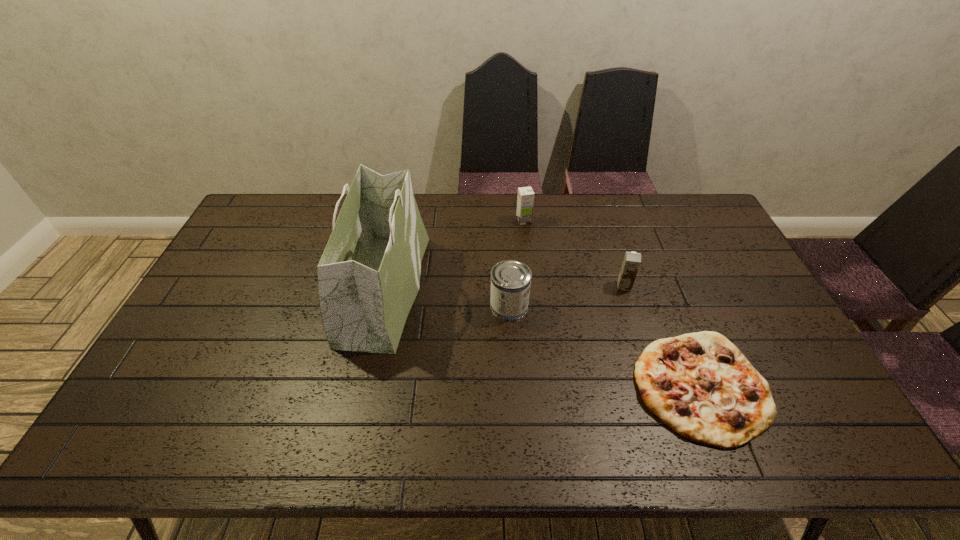
Identify the location of vacant region located on the left of the can. This screenshot has width=960, height=540. (360, 306).

Identify the location of vacant space located on the left of the pizza. (542, 387).

Where is `object that is positioned at the far edge`? This screenshot has width=960, height=540. object that is positioned at the far edge is located at coordinates (525, 200).

At what (x,y) coordinates should I click in order to perform the action: click on object present at the near edge. Please return your answer as a coordinate pair (x, y). The height and width of the screenshot is (540, 960). Looking at the image, I should click on (700, 385).

Identify the location of object present at the right edge. This screenshot has height=540, width=960. coord(700,385).

Locate an element on the screen. Image resolution: width=960 pixels, height=540 pixels. object located in the near right corner section of the desktop is located at coordinates (700, 385).

Image resolution: width=960 pixels, height=540 pixels. I want to click on blank space at the far edge of the desktop, so click(513, 219).

Where is `vacant space at the near edge of the desktop`? vacant space at the near edge of the desktop is located at coordinates (212, 436).

The image size is (960, 540). What are the coordinates of `free space at the left edge` in the screenshot? It's located at (138, 403).

In order to click on free space at the right edge of the desktop in this screenshot , I will do `click(773, 364)`.